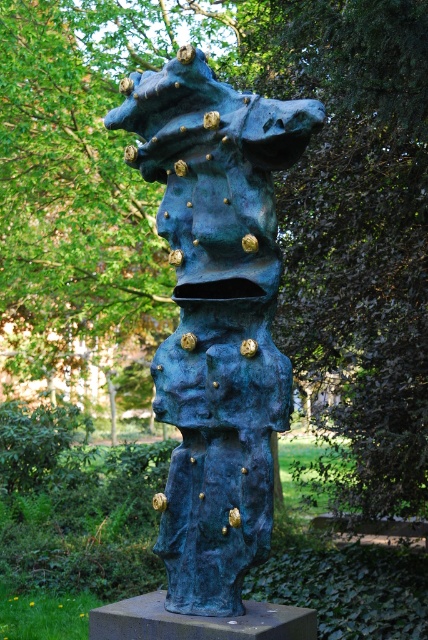
Is blue patinated bronze sculpture at center closer to the viewer compared to bronze pedestal at center?

No.

Between blue patinated bronze sculpture at center and bronze pedestal at center, which one has less height?

bronze pedestal at center is shorter.

Describe the element at coordinates (216, 314) in the screenshot. This screenshot has width=428, height=640. I see `blue patinated bronze sculpture at center` at that location.

Where is `blue patinated bronze sculpture at center`? The image size is (428, 640). blue patinated bronze sculpture at center is located at coordinates (216, 314).